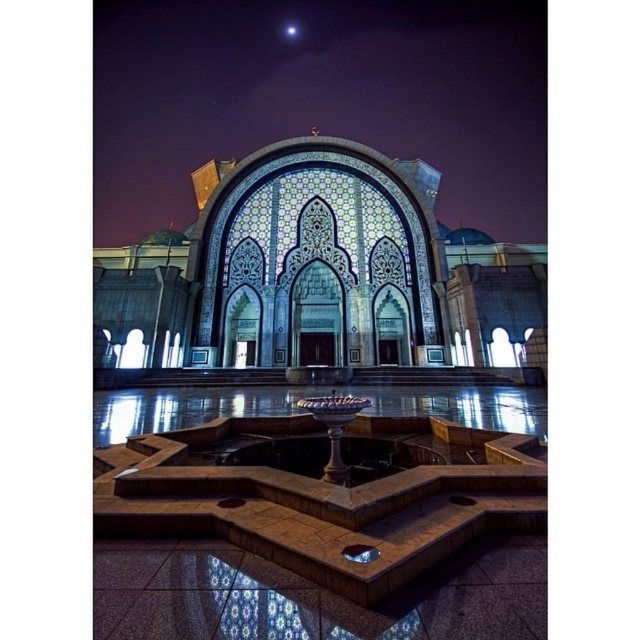
Does point (538, 564) come closer to viewer compared to point (408, 304)?

Yes, it is.

This screenshot has width=640, height=640. I want to click on polished stone fountain at center, so click(x=317, y=150).

The height and width of the screenshot is (640, 640). What do you see at coordinates (321, 275) in the screenshot? I see `polished stone palace at center` at bounding box center [321, 275].

Is polished stone palace at center thinner than white marble fountain at center?

In fact, polished stone palace at center might be wider than white marble fountain at center.

Is point (125, 314) in front of point (358, 406)?

No, it is behind (358, 406).

The height and width of the screenshot is (640, 640). I want to click on polished stone palace at center, so click(321, 275).

Does polished stone fountain at center have a larger size compared to white marble fountain at center?

Yes, polished stone fountain at center is bigger than white marble fountain at center.

Can you confirm if polished stone fountain at center is wider than white marble fountain at center?

Correct, the width of polished stone fountain at center exceeds that of white marble fountain at center.

What are the coordinates of `polished stone fountain at center` in the screenshot? It's located at (317, 150).

At what (x,y) coordinates should I click in order to perform the action: click on polished stone fountain at center. Please return your answer as a coordinate pair (x, y). Looking at the image, I should click on (317, 150).